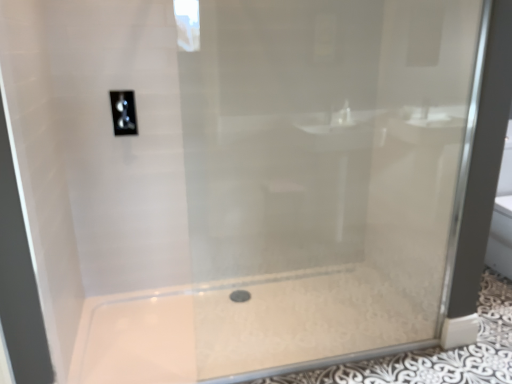
The width and height of the screenshot is (512, 384). Describe the element at coordinates (123, 112) in the screenshot. I see `satin nickel toggle at upper center` at that location.

The height and width of the screenshot is (384, 512). In order to click on satin nickel toggle at upper center in this screenshot , I will do `click(123, 112)`.

The image size is (512, 384). Describe the element at coordinates (243, 327) in the screenshot. I see `white glossy bath at center` at that location.

The image size is (512, 384). Find the location of `white glossy bath at center`. white glossy bath at center is located at coordinates (243, 327).

Where is `satin nickel toggle at upper center`? The width and height of the screenshot is (512, 384). satin nickel toggle at upper center is located at coordinates (123, 112).

Which is more to the left, satin nickel toggle at upper center or white glossy bath at center?

satin nickel toggle at upper center is more to the left.

Is satin nickel toggle at upper center positioned before white glossy bath at center?

No, the depth of satin nickel toggle at upper center is greater than that of white glossy bath at center.

Is point (122, 111) positioned in front of point (78, 334)?

Yes, it is in front of point (78, 334).

From the image's perspective, would you say satin nickel toggle at upper center is shown under white glossy bath at center?

Actually, satin nickel toggle at upper center appears above white glossy bath at center in the image.

From a real-world perspective, is satin nickel toggle at upper center below white glossy bath at center?

No.

Looking at this image, which object is thinner, satin nickel toggle at upper center or white glossy bath at center?

satin nickel toggle at upper center is thinner.

Is satin nickel toggle at upper center shorter than white glossy bath at center?

Incorrect, the height of satin nickel toggle at upper center does not fall short of that of white glossy bath at center.

Does satin nickel toggle at upper center have a larger size compared to white glossy bath at center?

Incorrect, satin nickel toggle at upper center is not larger than white glossy bath at center.

Based on the photo, is satin nickel toggle at upper center positioned beyond the bounds of white glossy bath at center?

Yes, satin nickel toggle at upper center is located beyond the bounds of white glossy bath at center.

Are satin nickel toggle at upper center and white glossy bath at center beside each other?

No, satin nickel toggle at upper center is not next to white glossy bath at center.

Is white glossy bath at center at the back of satin nickel toggle at upper center?

No.

How different are the orientations of satin nickel toggle at upper center and white glossy bath at center in degrees?

1.36 degrees separate the facing orientations of satin nickel toggle at upper center and white glossy bath at center.

I want to click on bath located below the satin nickel toggle at upper center (from the image's perspective), so click(243, 327).

Which is more to the left, white glossy bath at center or satin nickel toggle at upper center?

From the viewer's perspective, satin nickel toggle at upper center appears more on the left side.

Which object is closer to the camera taking this photo, white glossy bath at center or satin nickel toggle at upper center?

white glossy bath at center.

Consider the image. Which is closer to the camera, (321, 353) or (122, 122)?

The point (321, 353) is closer.

From the image's perspective, between white glossy bath at center and satin nickel toggle at upper center, who is located below?

white glossy bath at center, from the image's perspective.

From a real-world perspective, is white glossy bath at center located beneath satin nickel toggle at upper center?

Correct, in the physical world, white glossy bath at center is lower than satin nickel toggle at upper center.

Does white glossy bath at center have a lesser width compared to satin nickel toggle at upper center?

No, white glossy bath at center is not thinner than satin nickel toggle at upper center.

Which of these two, white glossy bath at center or satin nickel toggle at upper center, stands shorter?

white glossy bath at center.

Who is smaller, white glossy bath at center or satin nickel toggle at upper center?

satin nickel toggle at upper center.

Would you say satin nickel toggle at upper center is part of white glossy bath at center's contents?

No, satin nickel toggle at upper center is not a part of white glossy bath at center.

Is white glossy bath at center touching satin nickel toggle at upper center?

There is a gap between white glossy bath at center and satin nickel toggle at upper center.

Is satin nickel toggle at upper center at the back of white glossy bath at center?

No, white glossy bath at center is not facing the opposite direction of satin nickel toggle at upper center.

Measure the distance between white glossy bath at center and satin nickel toggle at upper center.

white glossy bath at center and satin nickel toggle at upper center are 3.86 feet apart.

The height and width of the screenshot is (384, 512). I want to click on bath below the satin nickel toggle at upper center (from a real-world perspective), so click(x=243, y=327).

Locate an element on the screen. This screenshot has height=384, width=512. bath below the satin nickel toggle at upper center (from the image's perspective) is located at coordinates (243, 327).

There is a white glossy bath at center. Where is `light switch above it (from a real-world perspective)`? The height and width of the screenshot is (384, 512). light switch above it (from a real-world perspective) is located at coordinates (123, 112).